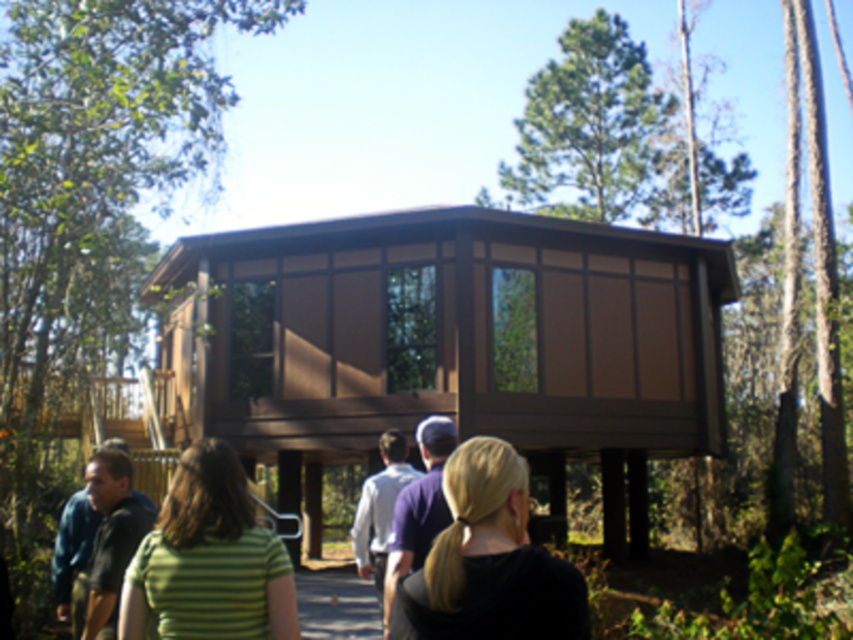
Measure the distance from green leafy tree at upper left to blonde hair at center.

green leafy tree at upper left and blonde hair at center are 10.17 meters apart from each other.

Who is more distant from viewer, (48,20) or (434,548)?

The point (48,20) is behind.

The height and width of the screenshot is (640, 853). Find the location of `green leafy tree at upper left`. green leafy tree at upper left is located at coordinates (90, 204).

Does green leafy tree at upper left have a greater width compared to green striped shirt at center?

Correct, the width of green leafy tree at upper left exceeds that of green striped shirt at center.

Is point (91, 168) positioned in front of point (206, 480)?

That is False.

The image size is (853, 640). Identify the location of green leafy tree at upper left. (90, 204).

Who is more forward, (x=463, y=344) or (x=364, y=522)?

Point (x=364, y=522) is more forward.

What do you see at coordinates (451, 344) in the screenshot?
I see `brown wood cabin at center` at bounding box center [451, 344].

I want to click on brown wood cabin at center, so click(451, 344).

The height and width of the screenshot is (640, 853). Find the location of `brown wood cabin at center`. brown wood cabin at center is located at coordinates (451, 344).